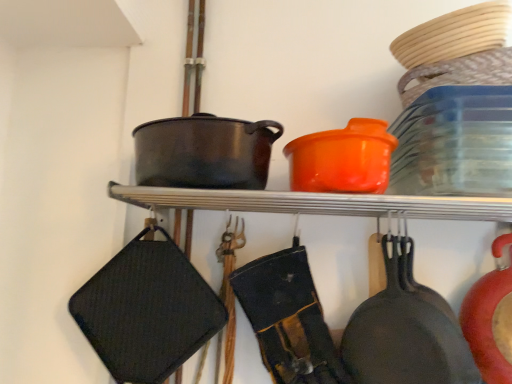
Question: Is orange plastic pot at upper center next to matte black frying pan at lower right?

Choices:
 (A) yes
 (B) no

Answer: (B)

Question: Is orange plastic pot at upper center aimed at matte black frying pan at lower right?

Choices:
 (A) yes
 (B) no

Answer: (B)

Question: From a real-world perspective, is orange plastic pot at upper center under matte black frying pan at lower right?

Choices:
 (A) yes
 (B) no

Answer: (B)

Question: Does orange plastic pot at upper center appear on the right side of matte black frying pan at lower right?

Choices:
 (A) yes
 (B) no

Answer: (B)

Question: Considering the relative sizes of orange plastic pot at upper center and matte black frying pan at lower right in the image provided, is orange plastic pot at upper center wider than matte black frying pan at lower right?

Choices:
 (A) yes
 (B) no

Answer: (A)

Question: Is orange plastic pot at upper center positioned before matte black frying pan at lower right?

Choices:
 (A) no
 (B) yes

Answer: (B)

Question: Would you say orange matte pot at upper center is a long distance from matte black wok at center?

Choices:
 (A) no
 (B) yes

Answer: (A)

Question: From the image's perspective, would you say orange matte pot at upper center is positioned over matte black wok at center?

Choices:
 (A) yes
 (B) no

Answer: (B)

Question: Does orange matte pot at upper center appear on the right side of matte black wok at center?

Choices:
 (A) no
 (B) yes

Answer: (B)

Question: Is orange matte pot at upper center turned away from matte black wok at center?

Choices:
 (A) no
 (B) yes

Answer: (A)

Question: Considering the relative positions of orange matte pot at upper center and matte black wok at center in the image provided, is orange matte pot at upper center behind matte black wok at center?

Choices:
 (A) yes
 (B) no

Answer: (B)

Question: Is orange matte pot at upper center closer to the viewer compared to matte black wok at center?

Choices:
 (A) no
 (B) yes

Answer: (B)

Question: Is orange matte pot at upper center turned away from matte black frying pan at lower right?

Choices:
 (A) no
 (B) yes

Answer: (A)